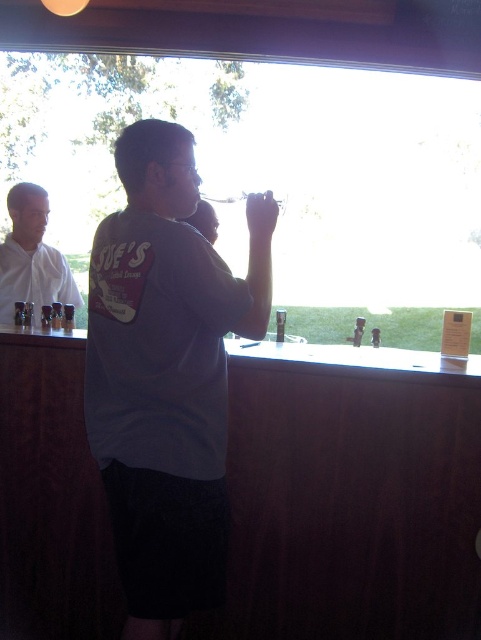
Question: Observing the image, what is the correct spatial positioning of gray cotton shirt at center in reference to white matte shirt at left?

Choices:
 (A) left
 (B) right

Answer: (B)

Question: Which point is farther to the camera?

Choices:
 (A) gray cotton shirt at center
 (B) white matte shirt at left

Answer: (B)

Question: Does gray cotton shirt at center have a greater width compared to white matte shirt at left?

Choices:
 (A) no
 (B) yes

Answer: (B)

Question: Can you confirm if gray cotton shirt at center is bigger than white matte shirt at left?

Choices:
 (A) yes
 (B) no

Answer: (A)

Question: Which point appears farthest from the camera in this image?

Choices:
 (A) (149, 209)
 (B) (55, 284)

Answer: (B)